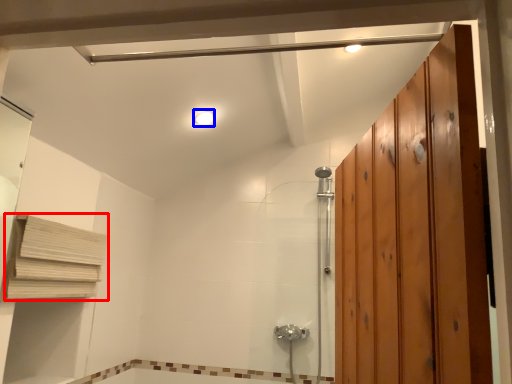
Question: Among these objects, which one is farthest to the camera, shelf (highlighted by a red box) or light fixture (highlighted by a blue box)?

Choices:
 (A) shelf
 (B) light fixture

Answer: (B)